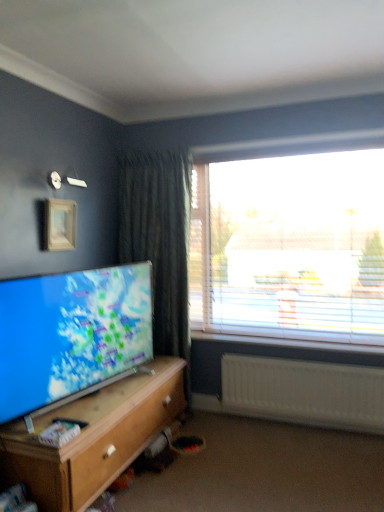
Where is `empty space that is ontop of transparent plastic window at upper right (from a real-world perspective)`? The width and height of the screenshot is (384, 512). empty space that is ontop of transparent plastic window at upper right (from a real-world perspective) is located at coordinates (296, 157).